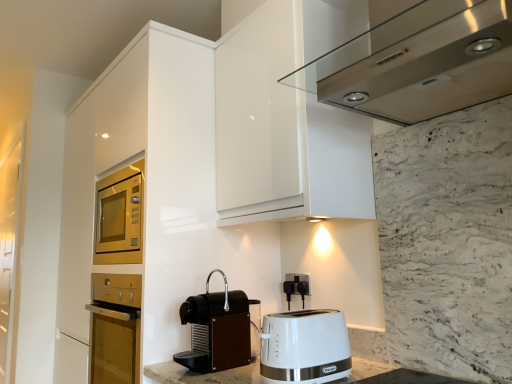
Question: Is satin stainless steel range hood at upper center beside transparent glass door at left?

Choices:
 (A) yes
 (B) no

Answer: (B)

Question: Does satin stainless steel range hood at upper center have a lesser width compared to transparent glass door at left?

Choices:
 (A) no
 (B) yes

Answer: (B)

Question: Can you confirm if satin stainless steel range hood at upper center is positioned to the right of transparent glass door at left?

Choices:
 (A) no
 (B) yes

Answer: (B)

Question: Considering the relative sizes of satin stainless steel range hood at upper center and transparent glass door at left in the image provided, is satin stainless steel range hood at upper center bigger than transparent glass door at left?

Choices:
 (A) yes
 (B) no

Answer: (B)

Question: From a real-world perspective, is satin stainless steel range hood at upper center physically above transparent glass door at left?

Choices:
 (A) yes
 (B) no

Answer: (A)

Question: Considering the positions of black plastic outlet at lower center and transparent glass door at left in the image, is black plastic outlet at lower center bigger or smaller than transparent glass door at left?

Choices:
 (A) small
 (B) big

Answer: (A)

Question: Based on their positions, is black plastic outlet at lower center located to the left or right of transparent glass door at left?

Choices:
 (A) left
 (B) right

Answer: (B)

Question: Is point (287, 273) closer or farther from the camera than point (4, 279)?

Choices:
 (A) farther
 (B) closer

Answer: (B)

Question: Relative to transparent glass door at left, is black plastic outlet at lower center in front or behind?

Choices:
 (A) front
 (B) behind

Answer: (A)

Question: From the image's perspective, is transparent glass door at left located above or below white plastic toaster at lower center?

Choices:
 (A) below
 (B) above

Answer: (A)

Question: From a real-world perspective, is transparent glass door at left positioned above or below white plastic toaster at lower center?

Choices:
 (A) below
 (B) above

Answer: (B)

Question: Would you say transparent glass door at left is inside or outside white plastic toaster at lower center?

Choices:
 (A) inside
 (B) outside

Answer: (B)

Question: Considering the positions of transparent glass door at left and white plastic toaster at lower center in the image, is transparent glass door at left taller or shorter than white plastic toaster at lower center?

Choices:
 (A) tall
 (B) short

Answer: (A)

Question: Considering the relative positions of white plastic toaster at lower center and black matte coffee machine at lower center in the image provided, is white plastic toaster at lower center to the left or to the right of black matte coffee machine at lower center?

Choices:
 (A) left
 (B) right

Answer: (B)

Question: Choose the correct answer: Is white plastic toaster at lower center inside black matte coffee machine at lower center or outside it?

Choices:
 (A) outside
 (B) inside

Answer: (A)